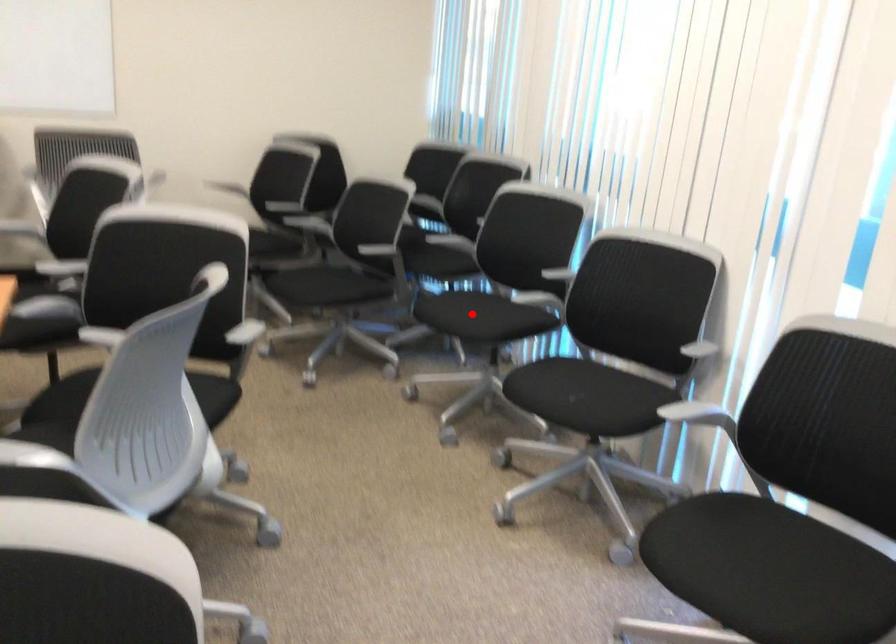
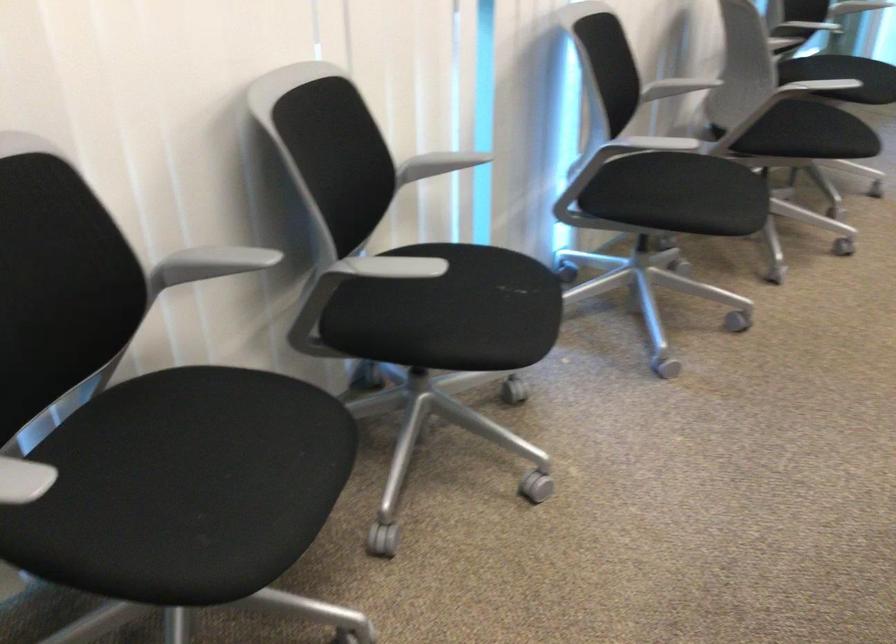
Question: I am providing you with two images of the same scene from different viewpoints. In image1, a red point is highlighted. Considering the same 3D point in image2, which of the following is correct?

Choices:
 (A) It is closer
 (B) It is farther

Answer: (A)